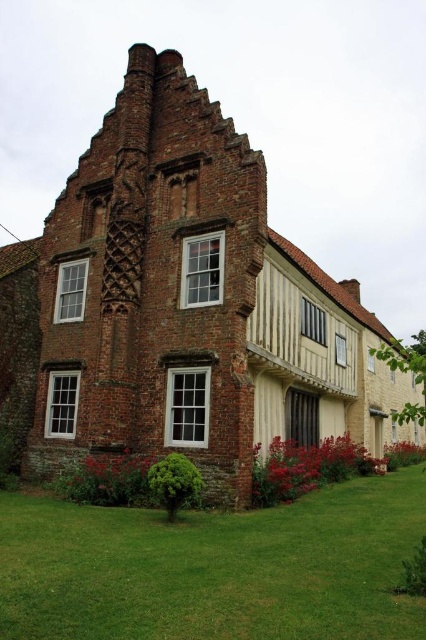
Which is in front, point (290, 637) or point (106, 467)?

Point (290, 637) is more forward.

Who is more distant from viewer, (193, 518) or (124, 465)?

The point (124, 465) is more distant.

Between point (293, 534) and point (132, 465), which one is positioned behind?

Positioned behind is point (132, 465).

Identify the location of green grass at lower center. (215, 566).

Is point (279, 440) closer to camera compared to point (111, 497)?

No, (279, 440) is further to viewer.

In the scene shown: Can you confirm if vivid red petals at lower center is positioned to the right of vivid red petals at lower left?

Indeed, vivid red petals at lower center is positioned on the right side of vivid red petals at lower left.

Who is more forward, (342, 480) or (92, 472)?

Point (92, 472) is more forward.

Where is `vivid red petals at lower center`? This screenshot has height=640, width=426. vivid red petals at lower center is located at coordinates (307, 467).

Is green grass at lower center positioned in front of vivid red petals at lower center?

That is True.

Is green grass at lower center smaller than vivid red petals at lower center?

Yes, green grass at lower center is smaller than vivid red petals at lower center.

Locate an element on the screen. Image resolution: width=426 pixels, height=640 pixels. green grass at lower center is located at coordinates (215, 566).

This screenshot has width=426, height=640. I want to click on green grass at lower center, so click(215, 566).